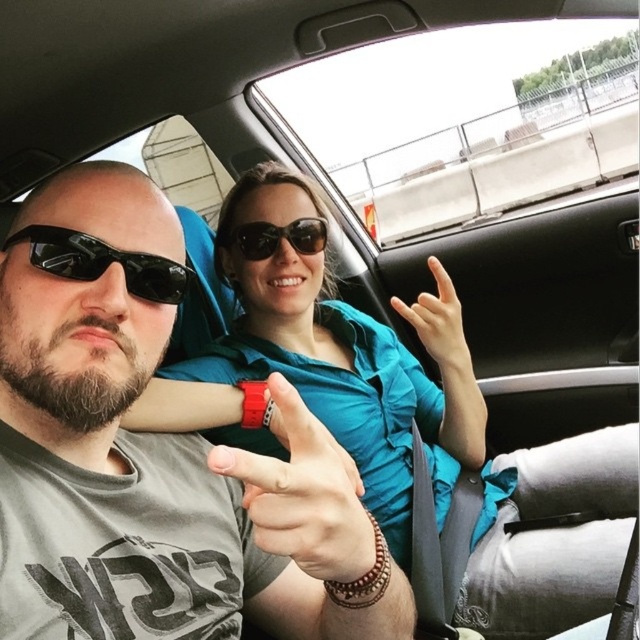
You are a passenger in the car and want to reach for the sunglasses at center. Is the blue fabric hand at center blocking your access to the matte black sunglasses at center?

The blue fabric hand at center is in front of the matte black sunglasses at center, so it is blocking access to them.

You are a designer working on a car interior layout. You need to ensure that the blue fabric hand at center and the matte black sunglasses at center can both fit on the dashboard without overlapping. Given their sizes, which object requires more space on the dashboard?

The blue fabric hand at center requires more space on the dashboard because it is larger in size than the matte black sunglasses at center.